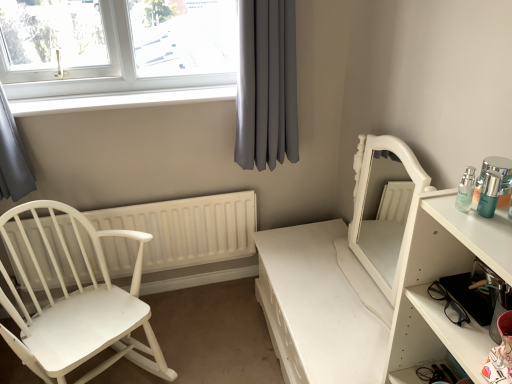
I want to click on free point above white glossy vanity at center right (from a real-world perspective), so click(355, 296).